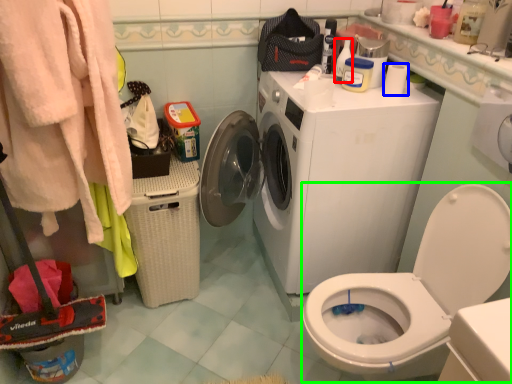
Question: Which object is positioned farthest from cleaning product (highlighted by a red box)? Select from toilet paper (highlighted by a blue box) and sit (highlighted by a green box).

Choices:
 (A) toilet paper
 (B) sit

Answer: (B)